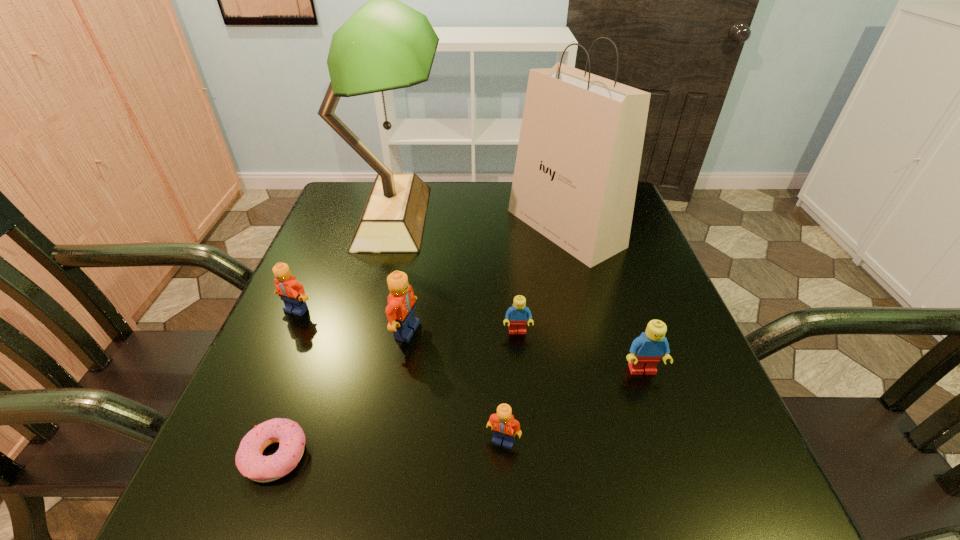
Identify the location of free spot located on the face of the smaller blue Lego. pyautogui.click(x=527, y=443).

Locate an element on the screen. The width and height of the screenshot is (960, 540). vacant space situated 0.320m on the right of the pink doughnut is located at coordinates (517, 456).

Identify the location of table lamp present at the far edge. [385, 45].

What are the coordinates of `shopping bag that is at the far edge` in the screenshot? It's located at (579, 153).

This screenshot has width=960, height=540. Identify the location of object that is at the near edge. (250, 462).

At what (x,y) coordinates should I click in order to perform the action: click on table lamp situated at the left edge. Please return your answer as a coordinate pair (x, y). The width and height of the screenshot is (960, 540). Looking at the image, I should click on (385, 45).

The width and height of the screenshot is (960, 540). Find the location of `Lego at the left edge`. Lego at the left edge is located at coordinates (x=292, y=293).

Find the location of a particular element. This screenshot has height=540, width=960. doughnut at the left edge is located at coordinates (250, 462).

The width and height of the screenshot is (960, 540). In order to click on shopping bag located at the right edge in this screenshot , I will do `click(579, 153)`.

Identify the location of Lego present at the right edge. The image size is (960, 540). (646, 350).